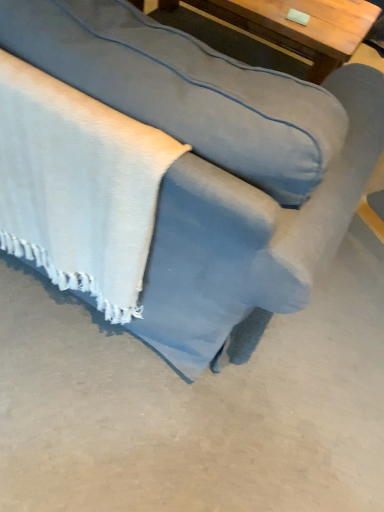
Question: Can you confirm if white textured blanket at lower left is shorter than suede-like blue couch at center?

Choices:
 (A) yes
 (B) no

Answer: (A)

Question: Considering the relative positions of white textured blanket at lower left and suede-like blue couch at center in the image provided, is white textured blanket at lower left to the left of suede-like blue couch at center from the viewer's perspective?

Choices:
 (A) no
 (B) yes

Answer: (B)

Question: Considering the relative sizes of white textured blanket at lower left and suede-like blue couch at center in the image provided, is white textured blanket at lower left wider than suede-like blue couch at center?

Choices:
 (A) no
 (B) yes

Answer: (A)

Question: From the image's perspective, is white textured blanket at lower left located above suede-like blue couch at center?

Choices:
 (A) no
 (B) yes

Answer: (A)

Question: Is white textured blanket at lower left oriented towards suede-like blue couch at center?

Choices:
 (A) no
 (B) yes

Answer: (B)

Question: Considering the relative sizes of white textured blanket at lower left and suede-like blue couch at center in the image provided, is white textured blanket at lower left taller than suede-like blue couch at center?

Choices:
 (A) yes
 (B) no

Answer: (B)

Question: Is wooden table at upper center facing towards white textured blanket at lower left?

Choices:
 (A) yes
 (B) no

Answer: (B)

Question: Is wooden table at upper center next to white textured blanket at lower left and touching it?

Choices:
 (A) no
 (B) yes

Answer: (A)

Question: Is white textured blanket at lower left completely or partially inside wooden table at upper center?

Choices:
 (A) yes
 (B) no

Answer: (B)

Question: Is wooden table at upper center further to camera compared to white textured blanket at lower left?

Choices:
 (A) yes
 (B) no

Answer: (A)

Question: Does wooden table at upper center have a lesser height compared to white textured blanket at lower left?

Choices:
 (A) yes
 (B) no

Answer: (A)

Question: Is white textured blanket at lower left at the back of wooden table at upper center?

Choices:
 (A) no
 (B) yes

Answer: (B)

Question: Considering the relative sizes of wooden table at upper center and suede-like blue couch at center in the image provided, is wooden table at upper center wider than suede-like blue couch at center?

Choices:
 (A) yes
 (B) no

Answer: (B)